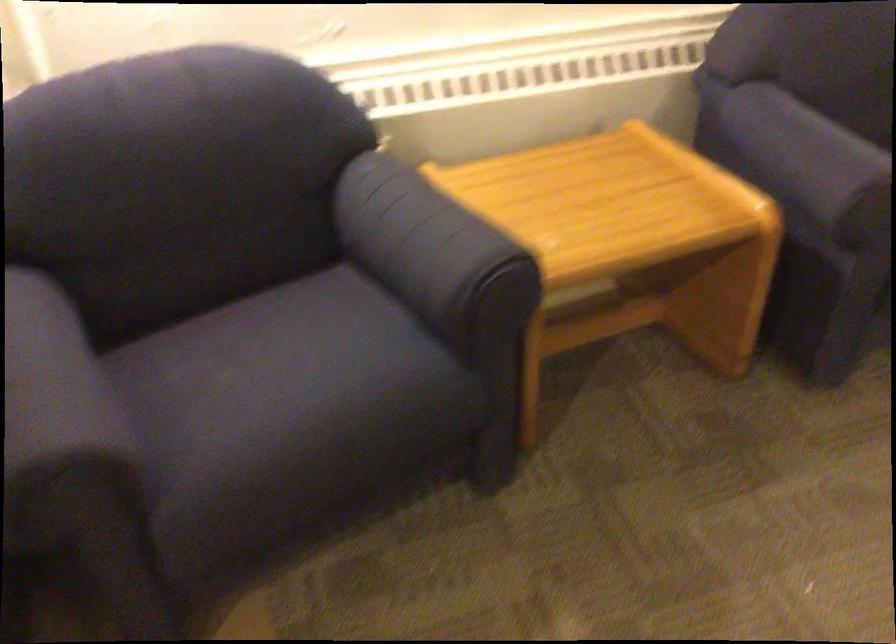
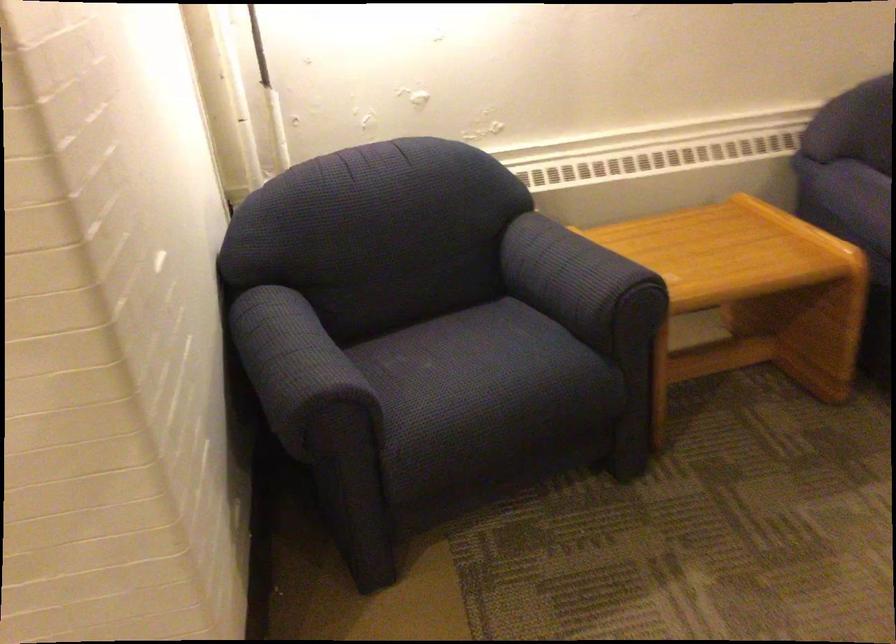
Where in the second image is the point corresponding to (x=306, y=400) from the first image?

(487, 377)